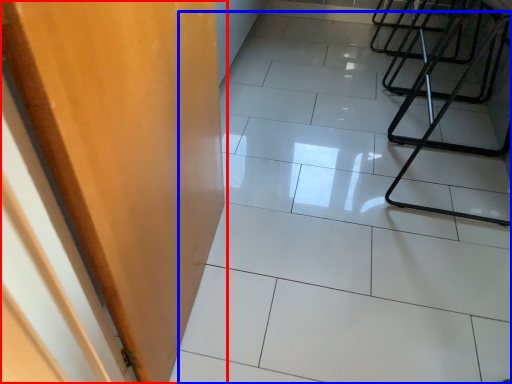
Question: Among these objects, which one is farthest to the camera, door (highlighted by a red box) or ceramic tile (highlighted by a blue box)?

Choices:
 (A) door
 (B) ceramic tile

Answer: (B)